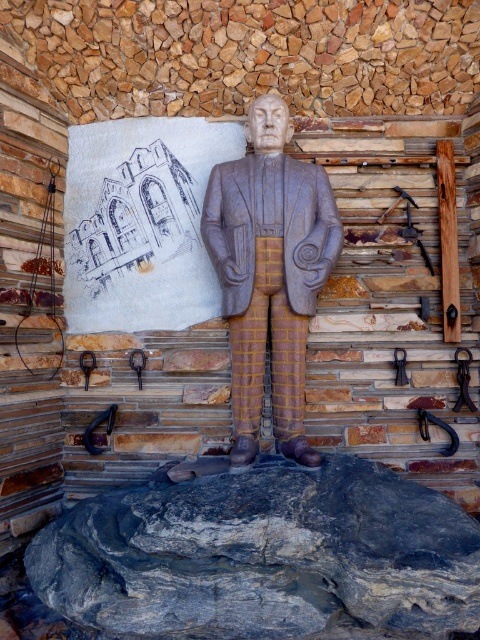
Question: Does matte stone statue at center appear under black metal hook at center?

Choices:
 (A) no
 (B) yes

Answer: (A)

Question: Which point appears closest to the camera in this image?

Choices:
 (A) (462, 349)
 (B) (88, 426)

Answer: (B)

Question: Which object is the closest to the gray/rocky stone at center?

Choices:
 (A) black rubber horseshoe at lower left
 (B) dark brown leather belt at center
 (C) matte stone statue at center
 (D) dark brown leather tool at right

Answer: (C)

Question: Which point is closer to the camera?

Choices:
 (A) dark brown leather belt at center
 (B) brushed metal hook at lower left
 (C) black metal hook at center

Answer: (A)

Question: Is the position of black rubber horseshoe at lower left less distant than that of dark brown leather belt at center?

Choices:
 (A) no
 (B) yes

Answer: (B)

Question: Does dark brown leather belt at center have a lesser width compared to black metal hook at center?

Choices:
 (A) yes
 (B) no

Answer: (A)